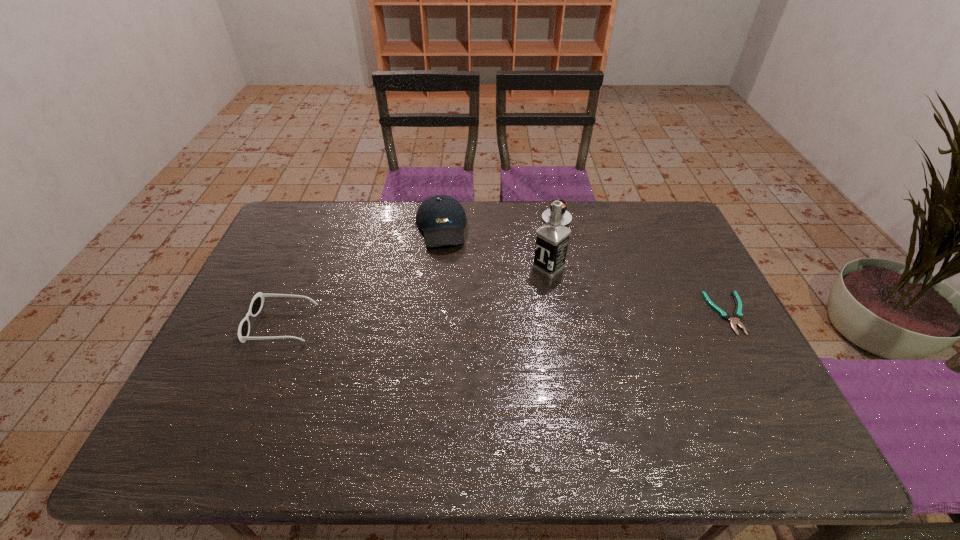
Locate an element on the screen. This screenshot has width=960, height=540. the leftmost object is located at coordinates (257, 302).

The image size is (960, 540). I want to click on the rightmost object, so click(x=738, y=315).

Locate an element on the screen. pliers is located at coordinates (738, 315).

The width and height of the screenshot is (960, 540). Find the location of `the third nearest object`. the third nearest object is located at coordinates (552, 238).

Find the location of a particular element. vodka is located at coordinates (552, 238).

This screenshot has height=540, width=960. I want to click on cappuccino, so click(566, 217).

Locate an element on the screen. This screenshot has width=960, height=540. the fourth shortest object is located at coordinates (441, 218).

Where is `the fourth object from right to left`? The width and height of the screenshot is (960, 540). the fourth object from right to left is located at coordinates (441, 218).

In order to click on vacant space situated 0.050m with the lenses of the sunglasses facing outward in this screenshot , I will do `click(232, 323)`.

Locate an element on the screen. The height and width of the screenshot is (540, 960). blank space located on the front of the shortest object is located at coordinates (755, 361).